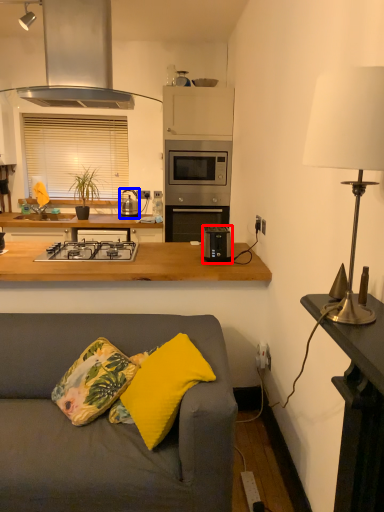
Question: Among these objects, which one is nearest to the camera, toaster (highlighted by a red box) or appliance (highlighted by a blue box)?

Choices:
 (A) toaster
 (B) appliance

Answer: (A)